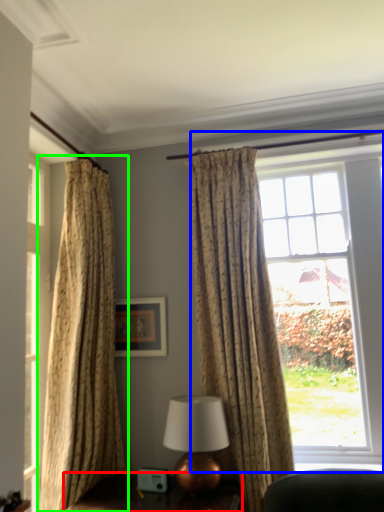
Question: Which object is the farthest from furniture (highlighted by a red box)? Choose among these: window (highlighted by a blue box) or curtain (highlighted by a green box).

Choices:
 (A) window
 (B) curtain

Answer: (A)